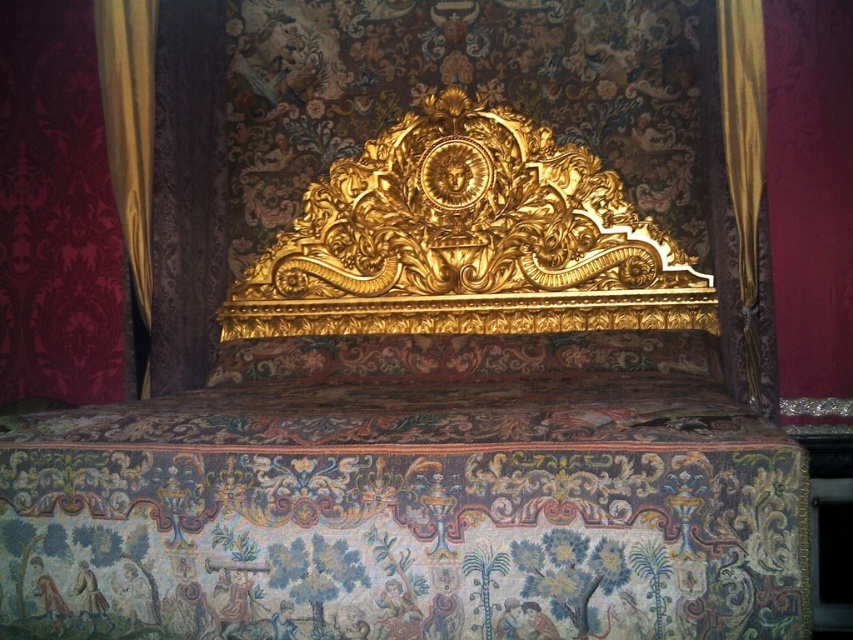
Does gold fabric curtain at left have a greater width compared to gold fabric curtain at right?

Yes, gold fabric curtain at left is wider than gold fabric curtain at right.

Does point (126, 205) come closer to viewer compared to point (749, 348)?

That is False.

The width and height of the screenshot is (853, 640). In order to click on gold fabric curtain at left in this screenshot , I will do `click(129, 124)`.